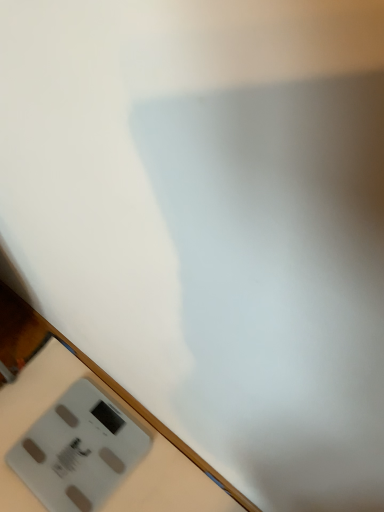
In the scene shown: What is the approximate width of white plastic scale at lower left?

The width of white plastic scale at lower left is 16.77 inches.

Find the location of a particular element. This screenshot has width=384, height=512. white plastic scale at lower left is located at coordinates [x=89, y=447].

Measure the distance between white plastic scale at lower left and camera.

They are 1.08 meters apart.

Describe the element at coordinates (89, 447) in the screenshot. I see `white plastic scale at lower left` at that location.

Describe the element at coordinates (79, 449) in the screenshot. The height and width of the screenshot is (512, 384). I see `gray plastic scale at bottom left` at that location.

Where is `gray plastic scale at bottom left`? gray plastic scale at bottom left is located at coordinates coord(79,449).

At what (x,y) coordinates should I click in order to perform the action: click on white plastic scale at lower left. Please return your answer as a coordinate pair (x, y). This screenshot has height=512, width=384. Looking at the image, I should click on [89, 447].

Can you confirm if white plastic scale at lower left is positioned to the left of gray plastic scale at bottom left?

No.

Which object is closer to the camera, white plastic scale at lower left or gray plastic scale at bottom left?

white plastic scale at lower left is more forward.

Does point (28, 405) lie in front of point (97, 448)?

No, it is not.

From the image's perspective, is white plastic scale at lower left above or below gray plastic scale at bottom left?

Based on their image positions, white plastic scale at lower left is located beneath gray plastic scale at bottom left.

From a real-world perspective, between white plastic scale at lower left and gray plastic scale at bottom left, who is vertically higher?

From a 3D spatial view, white plastic scale at lower left is above.

Which object is wider, white plastic scale at lower left or gray plastic scale at bottom left?

white plastic scale at lower left is wider.

Is white plastic scale at lower left taller or shorter than gray plastic scale at bottom left?

Clearly, white plastic scale at lower left is taller compared to gray plastic scale at bottom left.

Is white plastic scale at lower left bigger or smaller than gray plastic scale at bottom left?

In the image, white plastic scale at lower left appears to be larger than gray plastic scale at bottom left.

Would you say white plastic scale at lower left is inside or outside gray plastic scale at bottom left?

The correct answer is: outside.

Is the surface of white plastic scale at lower left in direct contact with gray plastic scale at bottom left?

Yes, white plastic scale at lower left is with gray plastic scale at bottom left.

Does white plastic scale at lower left turn towards gray plastic scale at bottom left?

Yes, white plastic scale at lower left is aimed at gray plastic scale at bottom left.

How many degrees apart are the facing directions of white plastic scale at lower left and gray plastic scale at bottom left?

The angle between the facing direction of white plastic scale at lower left and the facing direction of gray plastic scale at bottom left is 8.89 degrees.

How much distance is there between white plastic scale at lower left and gray plastic scale at bottom left?

white plastic scale at lower left and gray plastic scale at bottom left are 0.96 inches apart.

Find the location of a particular element. The image size is (384, 512). power plugs and sockets below the white plastic scale at lower left (from a real-world perspective) is located at coordinates (79, 449).

Can you confirm if gray plastic scale at bottom left is positioned to the right of white plastic scale at lower left?

In fact, gray plastic scale at bottom left is to the left of white plastic scale at lower left.

In the image, is gray plastic scale at bottom left positioned in front of or behind white plastic scale at lower left?

gray plastic scale at bottom left is positioned farther from the viewer than white plastic scale at lower left.

Is point (85, 391) closer or farther from the camera than point (106, 477)?

Point (85, 391) is farther from the camera than point (106, 477).

From the image's perspective, is gray plastic scale at bottom left over white plastic scale at lower left?

Correct, gray plastic scale at bottom left appears higher than white plastic scale at lower left in the image.

From a real-world perspective, which is physically above, gray plastic scale at bottom left or white plastic scale at lower left?

From a 3D spatial view, white plastic scale at lower left is above.

Considering the sizes of objects gray plastic scale at bottom left and white plastic scale at lower left in the image provided, who is wider, gray plastic scale at bottom left or white plastic scale at lower left?

With larger width is white plastic scale at lower left.

Who is taller, gray plastic scale at bottom left or white plastic scale at lower left?

white plastic scale at lower left is taller.

In terms of size, does gray plastic scale at bottom left appear bigger or smaller than white plastic scale at lower left?

Clearly, gray plastic scale at bottom left is smaller in size than white plastic scale at lower left.

Based on the photo, would you say gray plastic scale at bottom left is inside or outside white plastic scale at lower left?

gray plastic scale at bottom left can be found inside white plastic scale at lower left.

Is gray plastic scale at bottom left next to white plastic scale at lower left?

Yes, gray plastic scale at bottom left is next to white plastic scale at lower left.

From the picture: Could you tell me if gray plastic scale at bottom left is turned towards white plastic scale at lower left?

Yes, gray plastic scale at bottom left faces towards white plastic scale at lower left.

Identify the location of power plugs and sockets on the left of white plastic scale at lower left. (79, 449).

Find the location of `power plugs and sockets on the left of the white plastic scale at lower left`. power plugs and sockets on the left of the white plastic scale at lower left is located at coordinates (79, 449).

The height and width of the screenshot is (512, 384). There is a gray plastic scale at bottom left. Identify the location of table above it (from a real-world perspective). point(89,447).